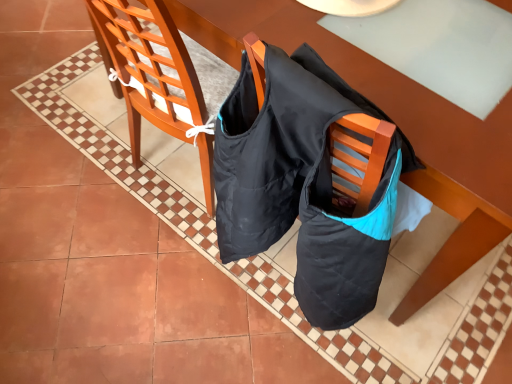
Image resolution: width=512 pixels, height=384 pixels. I want to click on free space that is to the left of matte wood chair at left, so click(89, 167).